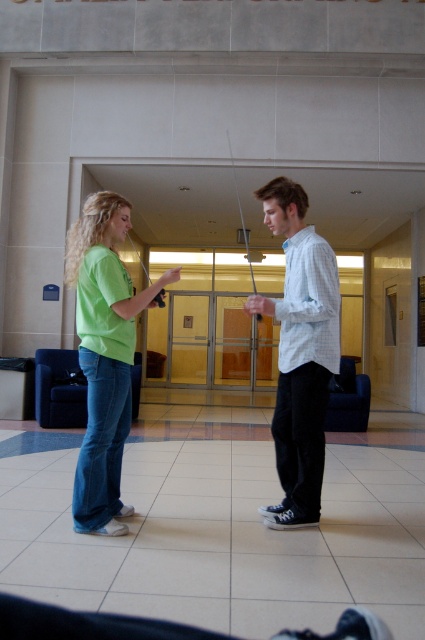
You are a fashion designer analyzing the image. You need to identify the color of the clothing item located at the specific coordinate point mentioned. What is the color of the clothing item at point (300, 356)?

The clothing item at point (300, 356) is a matte green t shirt at center.